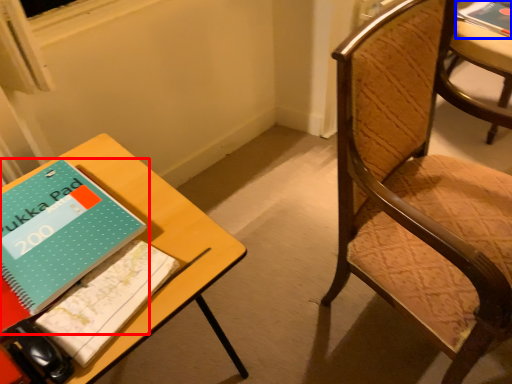
Question: Among these objects, which one is nearest to the camera, book (highlighted by a red box) or book (highlighted by a blue box)?

Choices:
 (A) book
 (B) book

Answer: (A)